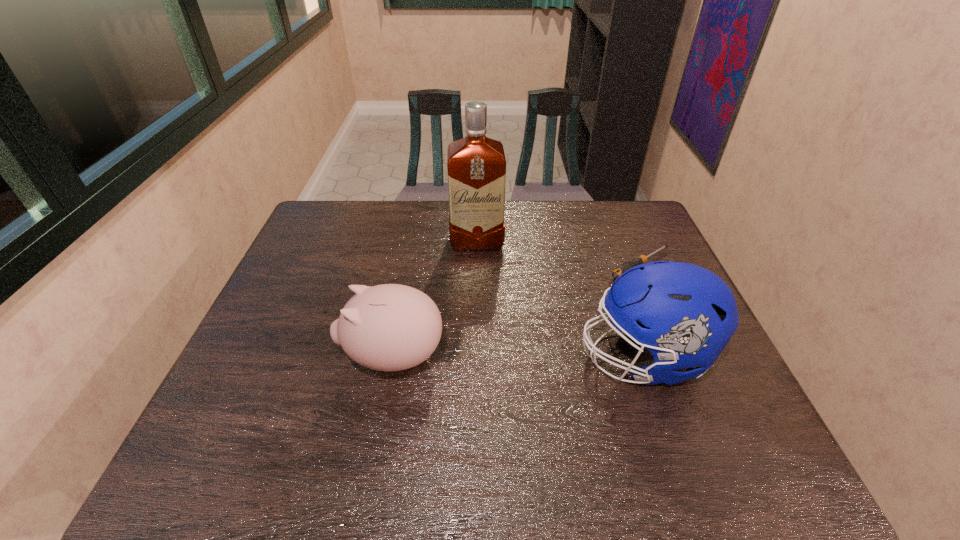
The width and height of the screenshot is (960, 540). I want to click on vacant region between the football helmet and the liquor, so click(560, 300).

Where is `vacant region between the piggy bank and the football helmet`? This screenshot has width=960, height=540. vacant region between the piggy bank and the football helmet is located at coordinates (518, 357).

At what (x,y) coordinates should I click in order to perform the action: click on vacant area between the liquor and the screwdriver. Please return your answer as a coordinate pair (x, y). Looking at the image, I should click on click(x=559, y=254).

The width and height of the screenshot is (960, 540). I want to click on the second closest object to the piggy bank, so click(x=683, y=314).

At what (x,y) coordinates should I click in order to perform the action: click on the second closest object to the liquor. Please return your answer as a coordinate pair (x, y). The width and height of the screenshot is (960, 540). Looking at the image, I should click on (390, 327).